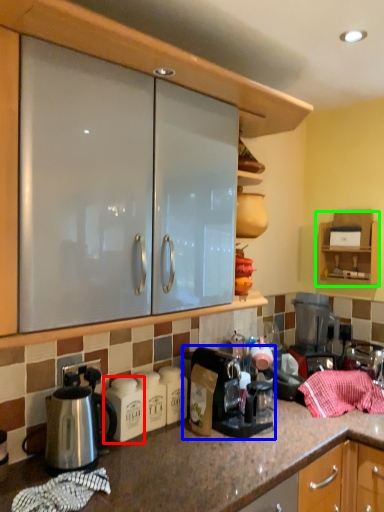
Question: Considering the real-world distances, which object is farthest from appliance (highlighted by a red box)? coffee maker (highlighted by a blue box) or cabinetry (highlighted by a green box)?

Choices:
 (A) coffee maker
 (B) cabinetry

Answer: (B)